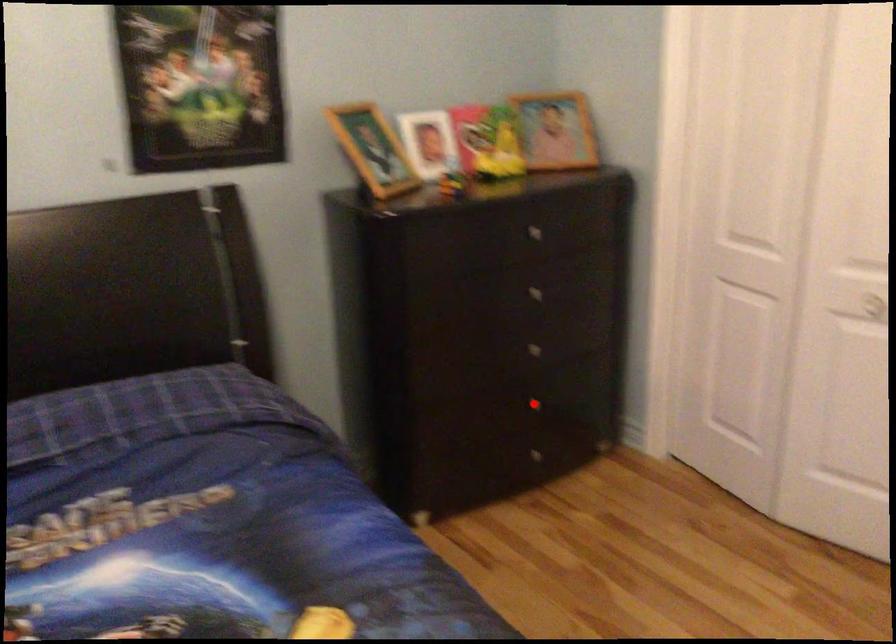
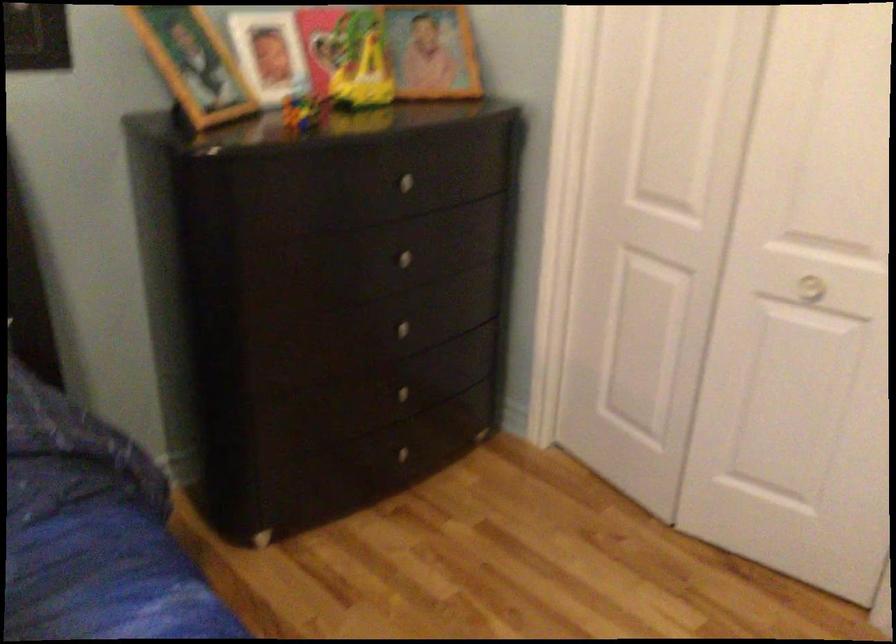
Where in the second image is the point corresponding to the highlighted location from the first image?

(400, 393)